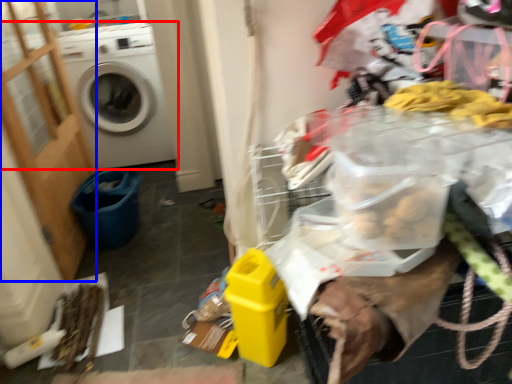
Question: Which of the following is the closest to the observer, washing machine (highlighted by a red box) or screen door (highlighted by a blue box)?

Choices:
 (A) washing machine
 (B) screen door

Answer: (B)